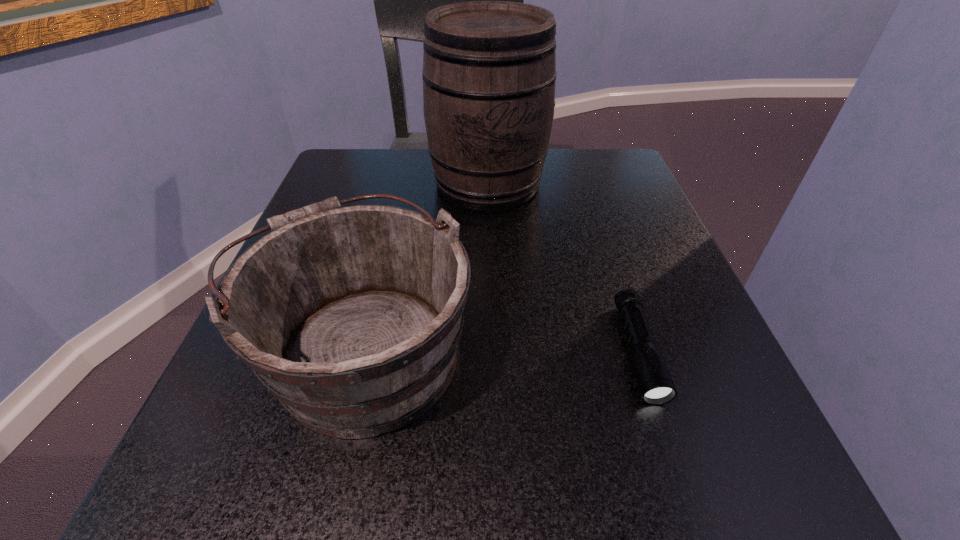
You are a GUI agent. You are given a task and a screenshot of the screen. Output one action in this format:
    pyautogui.click(x=<x>, y=<y>)
    Task: Click on the object situated at the near edge
    
    Given the screenshot: What is the action you would take?
    pyautogui.click(x=351, y=316)

The width and height of the screenshot is (960, 540). What are the coordinates of `object that is at the left edge` in the screenshot? It's located at (351, 316).

Where is `object present at the right edge`? object present at the right edge is located at coordinates (655, 383).

You are a GUI agent. You are given a task and a screenshot of the screen. Output one action in this format:
    pyautogui.click(x=<x>, y=<y>)
    Task: Click on the object at the near left corner
    
    Given the screenshot: What is the action you would take?
    pyautogui.click(x=351, y=316)

In the image, there is a desktop. Where is `vacant space at the far edge`? vacant space at the far edge is located at coordinates (561, 180).

The height and width of the screenshot is (540, 960). In the image, there is a desktop. In order to click on blank space at the near edge in this screenshot , I will do `click(379, 451)`.

In the image, there is a desktop. Where is `vacant space at the left edge`? This screenshot has width=960, height=540. vacant space at the left edge is located at coordinates (225, 395).

In the image, there is a desktop. Where is `free space at the right edge`? Image resolution: width=960 pixels, height=540 pixels. free space at the right edge is located at coordinates (683, 296).

This screenshot has height=540, width=960. I want to click on vacant area at the far left corner, so coord(351,190).

In the image, there is a desktop. Where is `vacant space at the far right corner`? The width and height of the screenshot is (960, 540). vacant space at the far right corner is located at coordinates (635, 180).